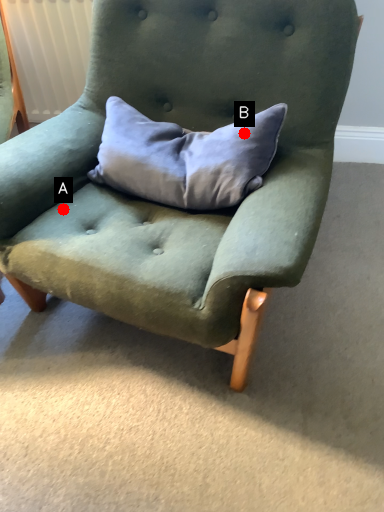
Question: Two points are circled on the image, labeled by A and B beside each circle. Which of the following is the closest to the observer?

Choices:
 (A) A is closer
 (B) B is closer

Answer: (B)